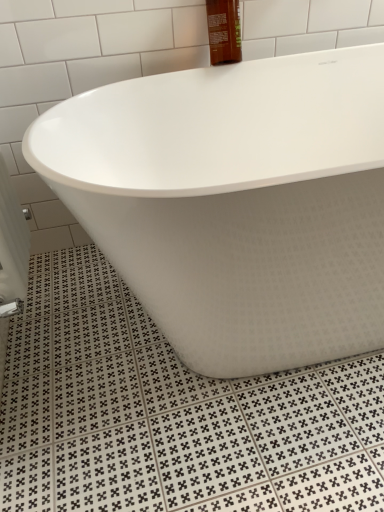
Identify the location of white matte bathtub at center. The height and width of the screenshot is (512, 384). (236, 203).

This screenshot has width=384, height=512. What do you see at coordinates (236, 203) in the screenshot? I see `white matte bathtub at center` at bounding box center [236, 203].

This screenshot has width=384, height=512. What do you see at coordinates (224, 31) in the screenshot?
I see `brown glass bottle at upper center` at bounding box center [224, 31].

Locate an element on the screen. This screenshot has height=512, width=384. brown glass bottle at upper center is located at coordinates (224, 31).

The height and width of the screenshot is (512, 384). In order to click on white matte bathtub at center in this screenshot , I will do `click(236, 203)`.

Is white matte bathtub at center to the right of brown glass bottle at upper center from the viewer's perspective?

Indeed, white matte bathtub at center is positioned on the right side of brown glass bottle at upper center.

Is white matte bathtub at center closer to the viewer compared to brown glass bottle at upper center?

Yes, it is.

Which is closer, (x=181, y=193) or (x=221, y=34)?

The point (x=181, y=193) is more forward.

From the image's perspective, between white matte bathtub at center and brown glass bottle at upper center, which one is located above?

brown glass bottle at upper center appears higher in the image.

From a real-world perspective, does white matte bathtub at center stand above brown glass bottle at upper center?

No, from a real-world perspective, white matte bathtub at center is not on top of brown glass bottle at upper center.

Which object is wider, white matte bathtub at center or brown glass bottle at upper center?

white matte bathtub at center.

Who is taller, white matte bathtub at center or brown glass bottle at upper center?

Standing taller between the two is white matte bathtub at center.

Considering the sizes of objects white matte bathtub at center and brown glass bottle at upper center in the image provided, who is bigger, white matte bathtub at center or brown glass bottle at upper center?

white matte bathtub at center.

Choose the correct answer: Is white matte bathtub at center inside brown glass bottle at upper center or outside it?

white matte bathtub at center is outside brown glass bottle at upper center.

Are white matte bathtub at center and brown glass bottle at upper center beside each other?

white matte bathtub at center and brown glass bottle at upper center are clearly separated.

Could you tell me if white matte bathtub at center is turned towards brown glass bottle at upper center?

No, white matte bathtub at center is not oriented towards brown glass bottle at upper center.

This screenshot has width=384, height=512. I want to click on mouthwash above the white matte bathtub at center (from the image's perspective), so click(x=224, y=31).

Which object is positioned more to the right, brown glass bottle at upper center or white matte bathtub at center?

white matte bathtub at center is more to the right.

Is the position of brown glass bottle at upper center less distant than that of white matte bathtub at center?

No, brown glass bottle at upper center is behind white matte bathtub at center.

Considering the positions of points (213, 10) and (164, 322), is point (213, 10) farther from camera compared to point (164, 322)?

Yes.

From the image's perspective, is brown glass bottle at upper center below white matte bathtub at center?

Actually, brown glass bottle at upper center appears above white matte bathtub at center in the image.

From a real-world perspective, does brown glass bottle at upper center stand above white matte bathtub at center?

Yes, from a real-world perspective, brown glass bottle at upper center is over white matte bathtub at center

From the picture: Can you confirm if brown glass bottle at upper center is thinner than white matte bathtub at center?

Yes, brown glass bottle at upper center is thinner than white matte bathtub at center.

Which of these two, brown glass bottle at upper center or white matte bathtub at center, stands shorter?

With less height is brown glass bottle at upper center.

Which of these two, brown glass bottle at upper center or white matte bathtub at center, is smaller?

Smaller between the two is brown glass bottle at upper center.

Would you say brown glass bottle at upper center is outside white matte bathtub at center?

Yes, brown glass bottle at upper center is not within white matte bathtub at center.

Is brown glass bottle at upper center touching white matte bathtub at center?

No, brown glass bottle at upper center is not touching white matte bathtub at center.

Is brown glass bottle at upper center turned away from white matte bathtub at center?

brown glass bottle at upper center is not turned away from white matte bathtub at center.

Where is `mouthwash above the white matte bathtub at center (from the image's perspective)`? This screenshot has height=512, width=384. mouthwash above the white matte bathtub at center (from the image's perspective) is located at coordinates pyautogui.click(x=224, y=31).

This screenshot has width=384, height=512. In the image, there is a brown glass bottle at upper center. In order to click on bathtub below it (from a real-world perspective) in this screenshot , I will do `click(236, 203)`.

This screenshot has height=512, width=384. I want to click on mouthwash on the left of white matte bathtub at center, so click(224, 31).